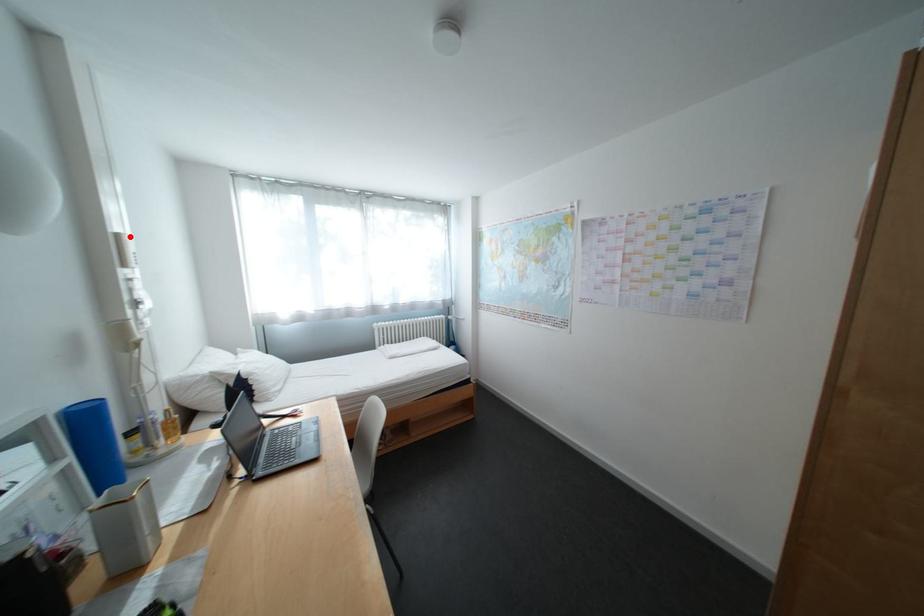
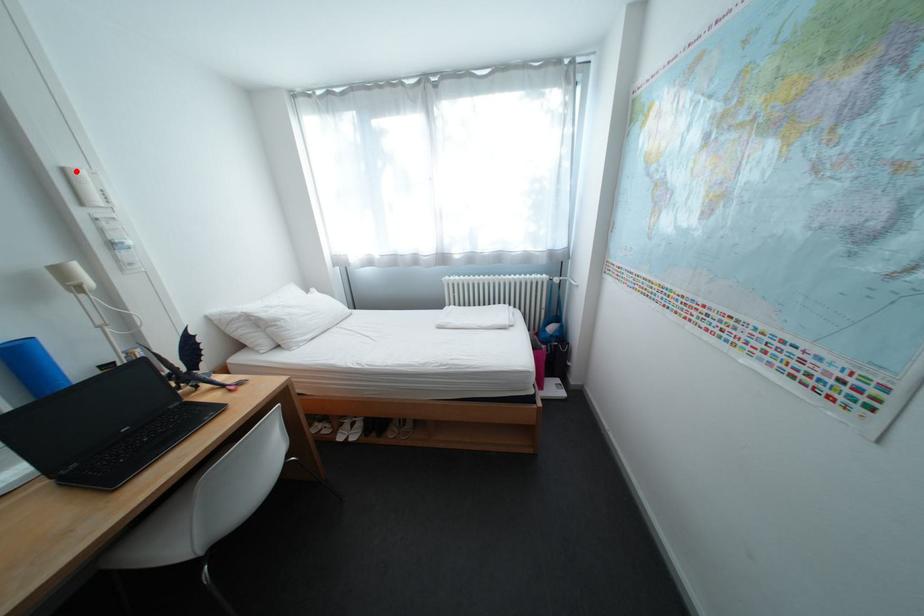
I am providing you with two images of the same scene from different viewpoints. A red point is marked on the first image and another point is marked on the second image. Are the points marked in image1 and image2 representing the same 3D position?

Yes